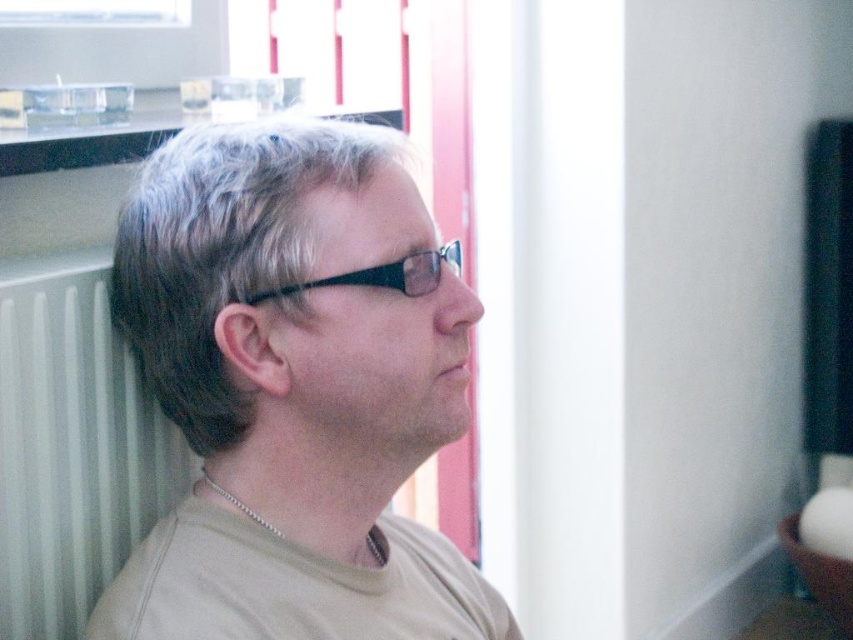
Is matte beige shirt at center smaller than silver chain at neck?

Incorrect, matte beige shirt at center is not smaller in size than silver chain at neck.

Who is taller, matte beige shirt at center or silver chain at neck?

matte beige shirt at center is taller.

Find the location of a particular element. matte beige shirt at center is located at coordinates (294, 388).

Image resolution: width=853 pixels, height=640 pixels. Describe the element at coordinates (294, 388) in the screenshot. I see `matte beige shirt at center` at that location.

You are a GUI agent. You are given a task and a screenshot of the screen. Output one action in this format:
    pyautogui.click(x=<x>, y=<y>)
    Task: Click on the matte beige shirt at center
    Image resolution: width=853 pixels, height=640 pixels.
    Given the screenshot: What is the action you would take?
    pyautogui.click(x=294, y=388)

Does matte beige shirt at center have a lesser width compared to black plastic glasses at center?

Incorrect, matte beige shirt at center's width is not less than black plastic glasses at center's.

Which of these two, matte beige shirt at center or black plastic glasses at center, stands shorter?

Standing shorter between the two is black plastic glasses at center.

Describe the element at coordinates (294, 388) in the screenshot. Image resolution: width=853 pixels, height=640 pixels. I see `matte beige shirt at center` at that location.

The height and width of the screenshot is (640, 853). I want to click on matte beige shirt at center, so click(294, 388).